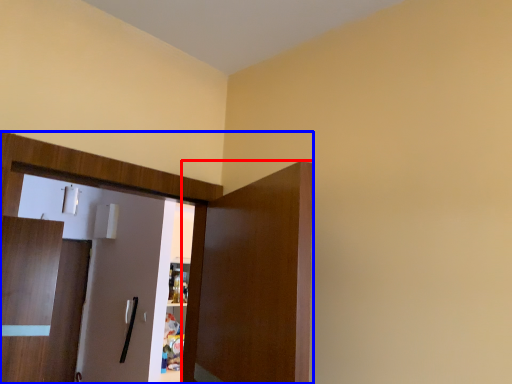
Question: Which of the following is the farthest to the observer, door (highlighted by a red box) or dresser (highlighted by a blue box)?

Choices:
 (A) door
 (B) dresser

Answer: (B)